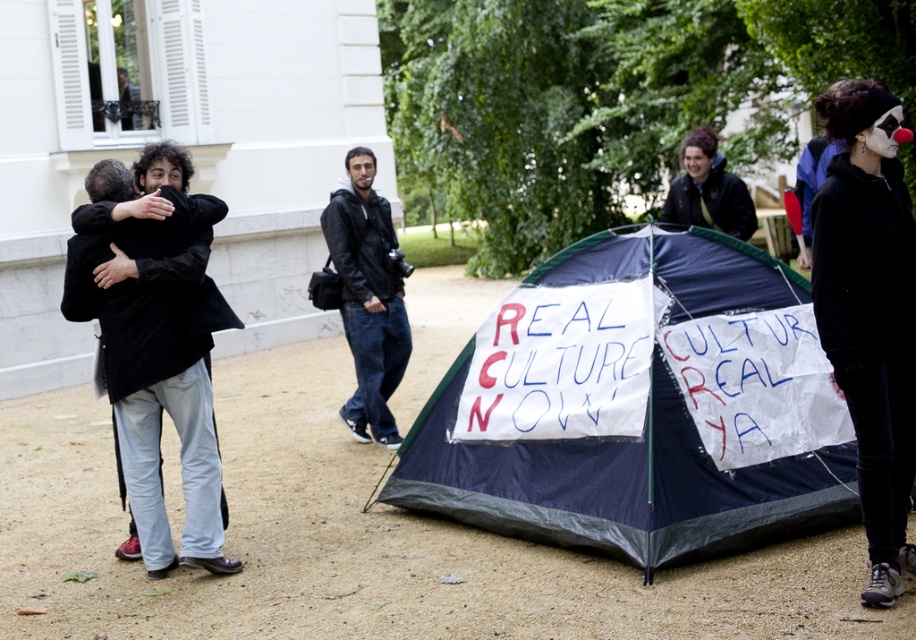
Question: Can you confirm if black matte sweatshirt at right is smaller than matte black jacket at upper center?

Choices:
 (A) yes
 (B) no

Answer: (B)

Question: Which point is farther to the camera?

Choices:
 (A) (127, 220)
 (B) (677, 200)
 (C) (432, 428)
 (D) (870, 572)

Answer: (B)

Question: Is dark blue tarpaulin tent at center positioned behind black coat at left?

Choices:
 (A) no
 (B) yes

Answer: (A)

Question: Is black leather jacket at center below matte black jacket at upper center?

Choices:
 (A) yes
 (B) no

Answer: (A)

Question: Among these objects, which one is nearest to the camera?

Choices:
 (A) dark blue tarpaulin tent at center
 (B) black coat at left
 (C) black leather jacket at center
 (D) matte black jacket at upper center

Answer: (A)

Question: Which of the following is the farthest from the observer?

Choices:
 (A) dark blue tarpaulin tent at center
 (B) black coat at left

Answer: (B)